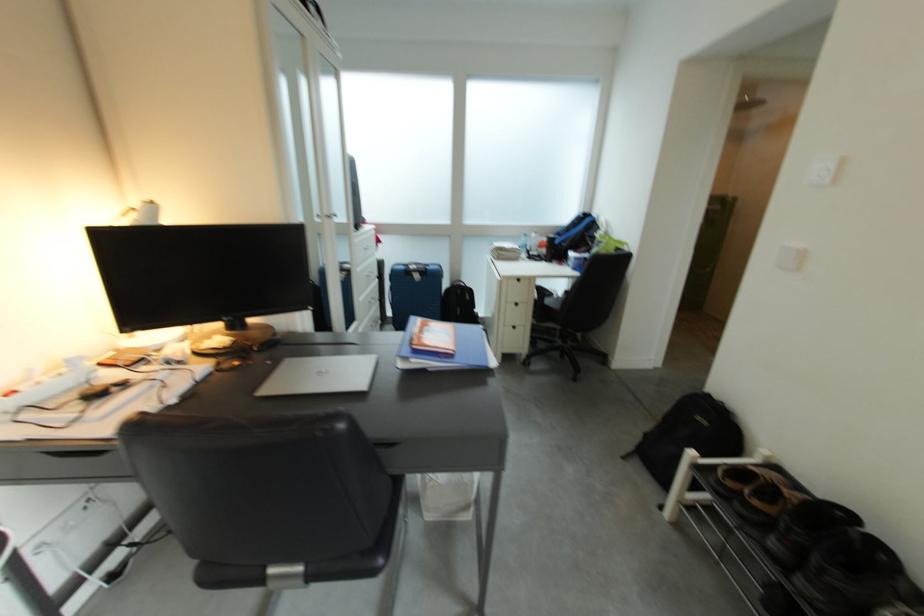
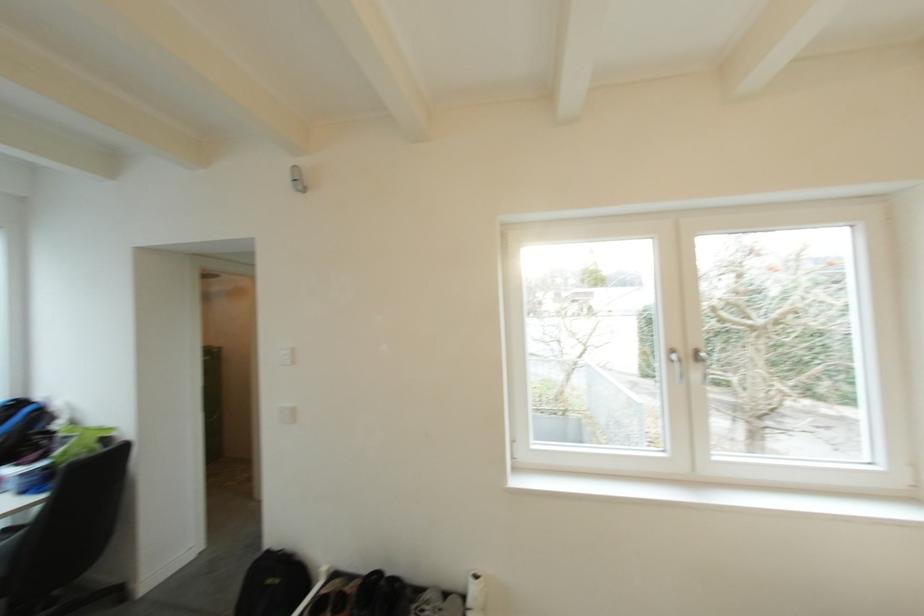
The point at (720, 399) is marked in the first image. Where is the corresponding point in the second image?

(280, 554)